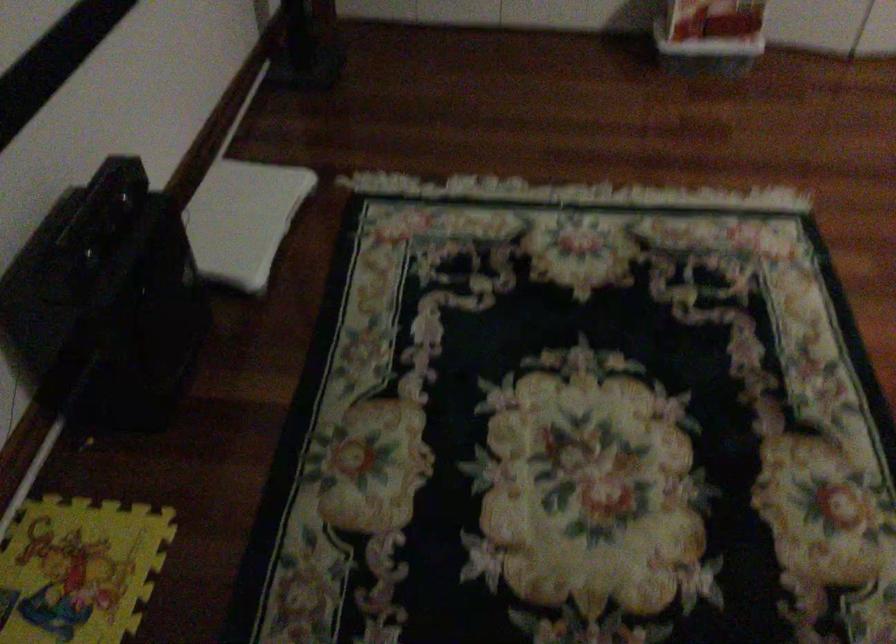
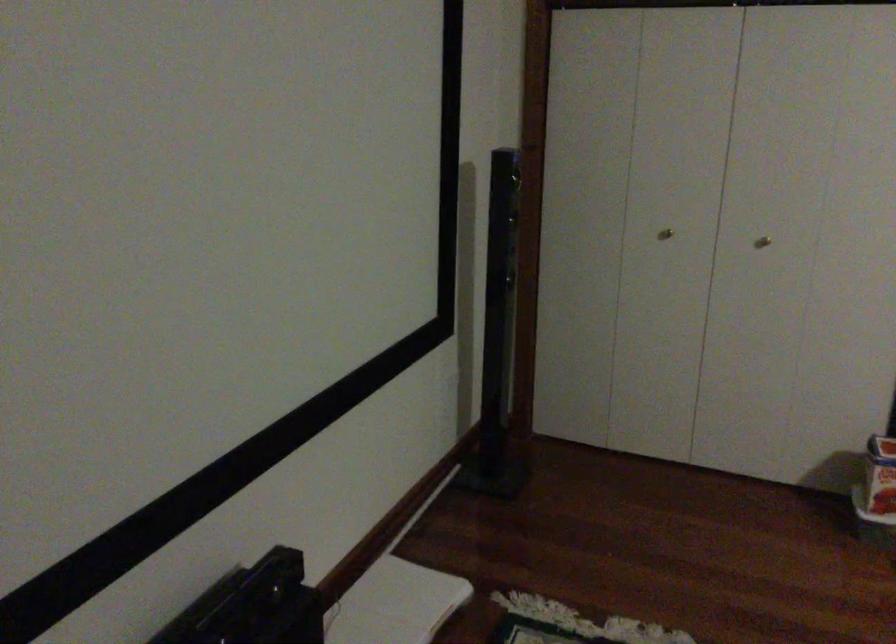
Where in the second image is the point corresponding to point 247,205 from the first image?

(394, 603)